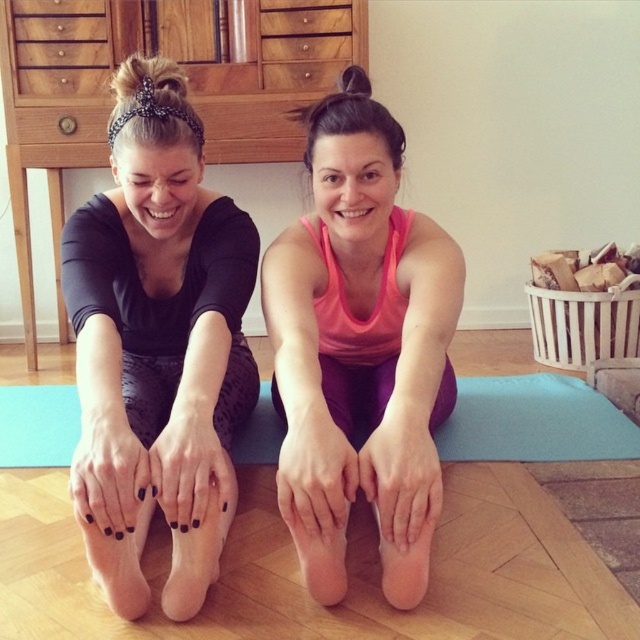
Question: Which point is farther to the camera?

Choices:
 (A) black matte foot at lower center
 (B) blue rubber yoga mat at center
 (C) black matte leggings at lower left

Answer: (B)

Question: Which point is farther from the camera taking this photo?

Choices:
 (A) (49, 422)
 (B) (227, 508)
 (C) (208, 285)
 (D) (394, 554)

Answer: (A)

Question: In this image, where is pink matte tank top at center located relative to blue rubber yoga mat at center?

Choices:
 (A) above
 (B) below

Answer: (A)

Question: Is pink matte tank top at center smaller than blue rubber yoga mat at center?

Choices:
 (A) no
 (B) yes

Answer: (A)

Question: Does black matte leggings at lower left come behind black matte foot at lower center?

Choices:
 (A) no
 (B) yes

Answer: (A)

Question: Which is nearer to the black matte foot at lower center?

Choices:
 (A) pink matte tank top at center
 (B) blue rubber yoga mat at center
 (C) black matte leggings at lower left

Answer: (C)